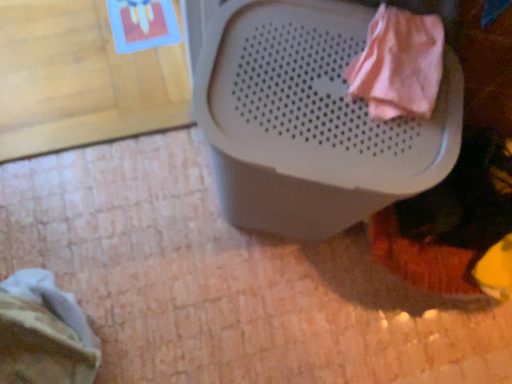
Question: Does striped fabric at lower left, which is the second clothing from right to left, have a lesser width compared to pink fabric at upper right, which appears as the 1th clothing when viewed from the right?

Choices:
 (A) no
 (B) yes

Answer: (A)

Question: Can you confirm if striped fabric at lower left, positioned as the 2th clothing in front-to-back order, is bigger than pink fabric at upper right, which appears as the 1th clothing when viewed from the right?

Choices:
 (A) yes
 (B) no

Answer: (A)

Question: From a real-world perspective, is striped fabric at lower left, positioned as the 2th clothing in top-to-bottom order, over pink fabric at upper right, the 2th clothing positioned from the back?

Choices:
 (A) no
 (B) yes

Answer: (A)

Question: Considering the relative sizes of striped fabric at lower left, positioned as the 2th clothing in top-to-bottom order, and pink fabric at upper right, the second clothing viewed from the left, in the image provided, is striped fabric at lower left, positioned as the 2th clothing in top-to-bottom order, shorter than pink fabric at upper right, the second clothing viewed from the left,?

Choices:
 (A) no
 (B) yes

Answer: (A)

Question: Can you confirm if striped fabric at lower left, which ranks as the first clothing in left-to-right order, is taller than pink fabric at upper right, marked as the first clothing in a front-to-back arrangement?

Choices:
 (A) yes
 (B) no

Answer: (A)

Question: Is striped fabric at lower left, the first clothing ordered from the bottom, placed right next to pink fabric at upper right, the 2th clothing when ordered from bottom to top?

Choices:
 (A) yes
 (B) no

Answer: (B)

Question: Does white plastic waste container at upper center have a smaller size compared to striped fabric at lower left, positioned as the 2th clothing in front-to-back order?

Choices:
 (A) yes
 (B) no

Answer: (B)

Question: Can you confirm if white plastic waste container at upper center is positioned to the right of striped fabric at lower left, which is the second clothing from right to left?

Choices:
 (A) no
 (B) yes

Answer: (B)

Question: Does white plastic waste container at upper center appear on the left side of striped fabric at lower left, which is the second clothing from right to left?

Choices:
 (A) no
 (B) yes

Answer: (A)

Question: Does white plastic waste container at upper center turn towards striped fabric at lower left, positioned as the 2th clothing in front-to-back order?

Choices:
 (A) no
 (B) yes

Answer: (A)

Question: Would you consider white plastic waste container at upper center to be distant from striped fabric at lower left, the first clothing ordered from the bottom?

Choices:
 (A) yes
 (B) no

Answer: (B)

Question: Does white plastic waste container at upper center have a larger size compared to striped fabric at lower left, marked as the 1th clothing in a back-to-front arrangement?

Choices:
 (A) no
 (B) yes

Answer: (B)

Question: Considering the relative sizes of white plastic waste container at upper center and pink fabric at upper right, which is the 1th clothing from top to bottom, in the image provided, is white plastic waste container at upper center smaller than pink fabric at upper right, which is the 1th clothing from top to bottom,?

Choices:
 (A) yes
 (B) no

Answer: (B)